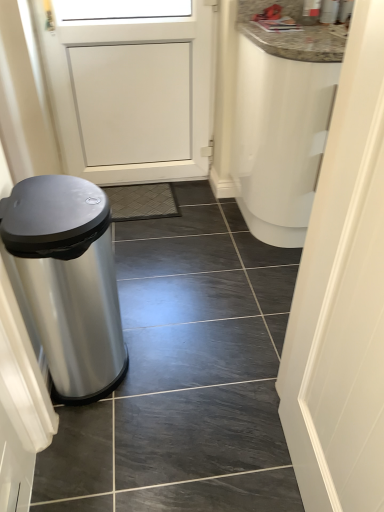
Question: Considering the relative sizes of slate tile at left and white matte door at right in the image provided, is slate tile at left wider than white matte door at right?

Choices:
 (A) no
 (B) yes

Answer: (B)

Question: From the image's perspective, is slate tile at left on top of white matte door at right?

Choices:
 (A) no
 (B) yes

Answer: (B)

Question: Does slate tile at left turn towards white matte door at right?

Choices:
 (A) no
 (B) yes

Answer: (A)

Question: Considering the relative sizes of slate tile at left and white matte door at right in the image provided, is slate tile at left bigger than white matte door at right?

Choices:
 (A) no
 (B) yes

Answer: (A)

Question: Is white matte door at right a part of slate tile at left?

Choices:
 (A) no
 (B) yes

Answer: (A)

Question: From a real-world perspective, is slate tile at left located beneath white matte door at right?

Choices:
 (A) no
 (B) yes

Answer: (B)

Question: From a real-world perspective, does polished stainless steel trash can at left sit lower than white matte door at right?

Choices:
 (A) no
 (B) yes

Answer: (B)

Question: From a real-world perspective, is polished stainless steel trash can at left physically above white matte door at right?

Choices:
 (A) no
 (B) yes

Answer: (A)

Question: Can you confirm if polished stainless steel trash can at left is positioned to the right of white matte door at right?

Choices:
 (A) no
 (B) yes

Answer: (A)

Question: Is polished stainless steel trash can at left taller than white matte door at right?

Choices:
 (A) yes
 (B) no

Answer: (B)

Question: Is polished stainless steel trash can at left positioned beyond the bounds of white matte door at right?

Choices:
 (A) no
 (B) yes

Answer: (B)

Question: From the image's perspective, is polished stainless steel trash can at left over white matte door at right?

Choices:
 (A) yes
 (B) no

Answer: (A)

Question: From a real-world perspective, does slate tile at left sit lower than polished stainless steel trash can at left?

Choices:
 (A) no
 (B) yes

Answer: (B)